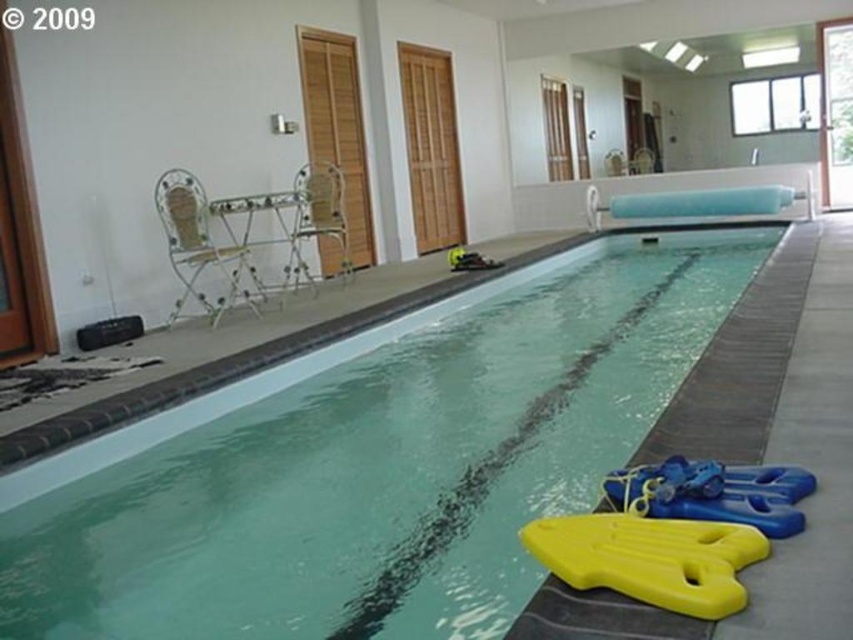
Question: Can you confirm if yellow foam float at lower right is positioned below yellow plastic float at lower right?

Choices:
 (A) no
 (B) yes

Answer: (B)

Question: Can you confirm if yellow foam float at lower right is positioned to the right of yellow plastic float at lower right?

Choices:
 (A) yes
 (B) no

Answer: (B)

Question: Is yellow foam float at lower right closer to the viewer compared to yellow plastic float at lower right?

Choices:
 (A) no
 (B) yes

Answer: (B)

Question: Which object is closer to the camera taking this photo?

Choices:
 (A) yellow foam float at lower right
 (B) yellow plastic float at lower right

Answer: (A)

Question: Among these objects, which one is nearest to the camera?

Choices:
 (A) yellow plastic float at lower right
 (B) yellow foam float at lower right

Answer: (B)

Question: Which point appears closest to the camera in this image?

Choices:
 (A) (605, 582)
 (B) (689, 461)

Answer: (A)